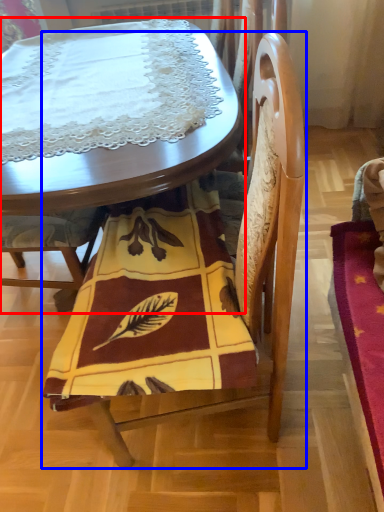
Question: Among these objects, which one is farthest to the camera, table (highlighted by a red box) or chair (highlighted by a blue box)?

Choices:
 (A) table
 (B) chair

Answer: (A)